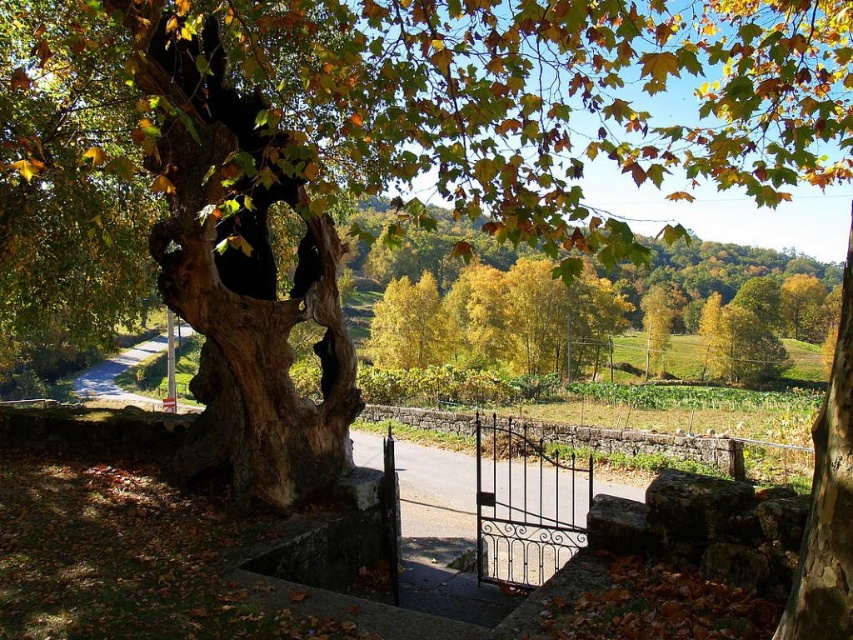
Question: Does black wrought iron gate at center lie in front of yellow-green leaves at center?

Choices:
 (A) yes
 (B) no

Answer: (A)

Question: Which is farther from the black wrought iron gate at center?

Choices:
 (A) yellow-green leaves at center
 (B) brown rough bark at center

Answer: (A)

Question: Which point is farther to the camera?

Choices:
 (A) black wrought iron gate at center
 (B) brown rough bark at center

Answer: (A)

Question: Which object is positioned closest to the yellow-green leaves at center?

Choices:
 (A) brown rough bark at center
 (B) black wrought iron gate at center

Answer: (B)

Question: Can you confirm if black wrought iron gate at center is positioned to the right of brown rough bark at center?

Choices:
 (A) no
 (B) yes

Answer: (A)

Question: Observing the image, what is the correct spatial positioning of black wrought iron gate at center in reference to brown rough bark at center?

Choices:
 (A) below
 (B) above

Answer: (A)